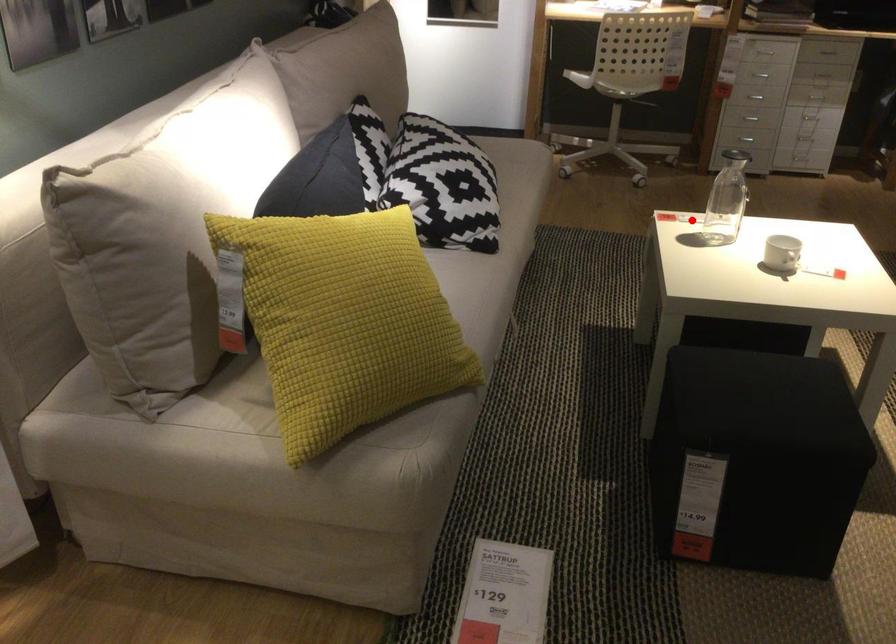
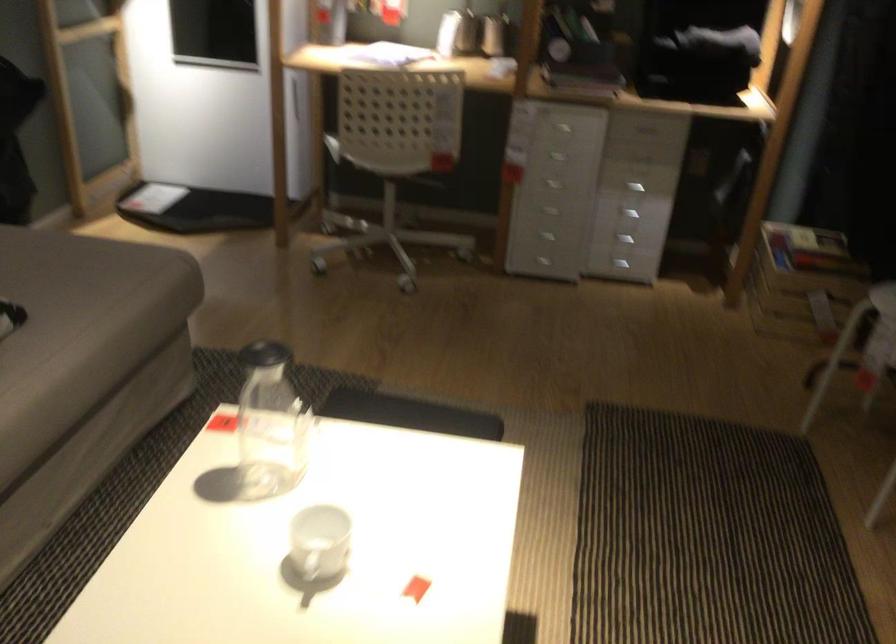
Question: I am providing you with two images of the same scene from different viewpoints. Image1 has a red point marked. In image2, the corresponding 3D location appears at what relative position? Reply with the corresponding letter.

Choices:
 (A) Closer
 (B) Farther

Answer: (A)